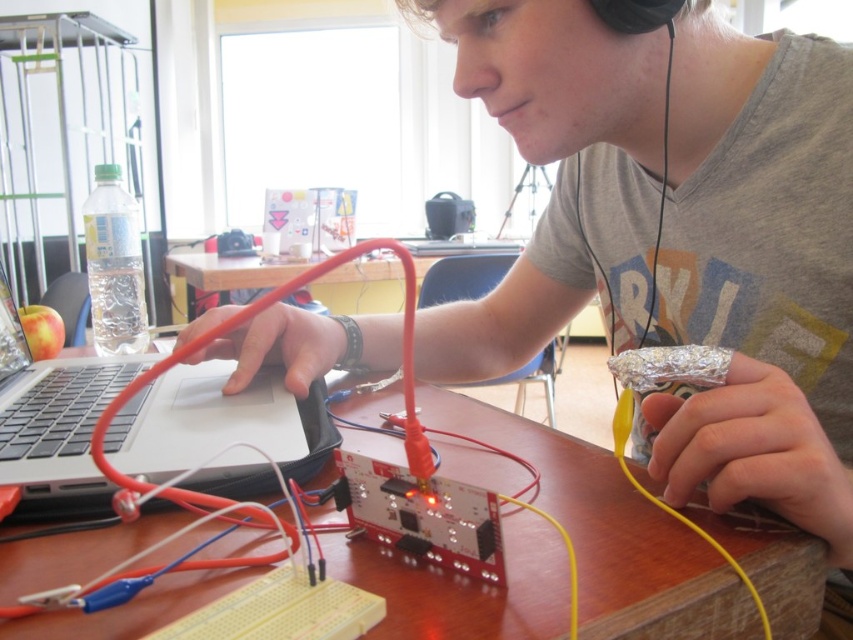
Does wooden table at center appear under rubberized plastic table at center?

Yes.

Who is lower down, wooden table at center or rubberized plastic table at center?

wooden table at center

Does point (759, 566) come behind point (190, 275)?

No, (759, 566) is closer to viewer.

At what (x,y) coordinates should I click in order to perform the action: click on wooden table at center. Please return your answer as a coordinate pair (x, y). This screenshot has height=640, width=853. Looking at the image, I should click on (608, 518).

Does wooden table at center appear over silver/black laptop at center?

No.

At what (x,y) coordinates should I click in order to perform the action: click on wooden table at center. Please return your answer as a coordinate pair (x, y). This screenshot has height=640, width=853. Looking at the image, I should click on (608, 518).

The image size is (853, 640). I want to click on wooden table at center, so click(608, 518).

Who is positioned more to the left, silver/black laptop at center or rubberized plastic table at center?

Positioned to the left is rubberized plastic table at center.

Is point (190, 426) positioned before point (366, 284)?

Yes, point (190, 426) is in front of point (366, 284).

Does point (154, 461) come farther from viewer compared to point (350, 301)?

No, (154, 461) is closer to viewer.

Locate an element on the screen. silver/black laptop at center is located at coordinates (215, 422).